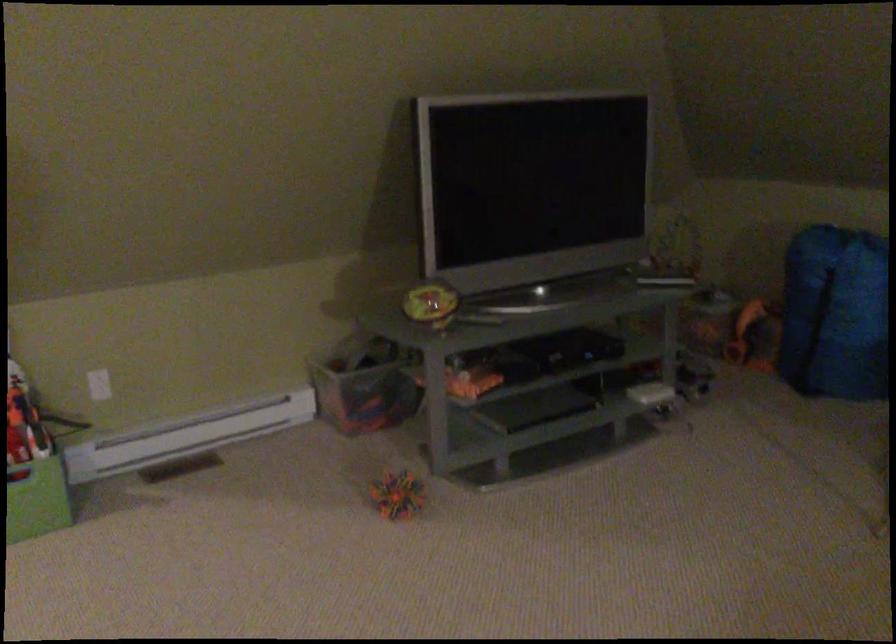
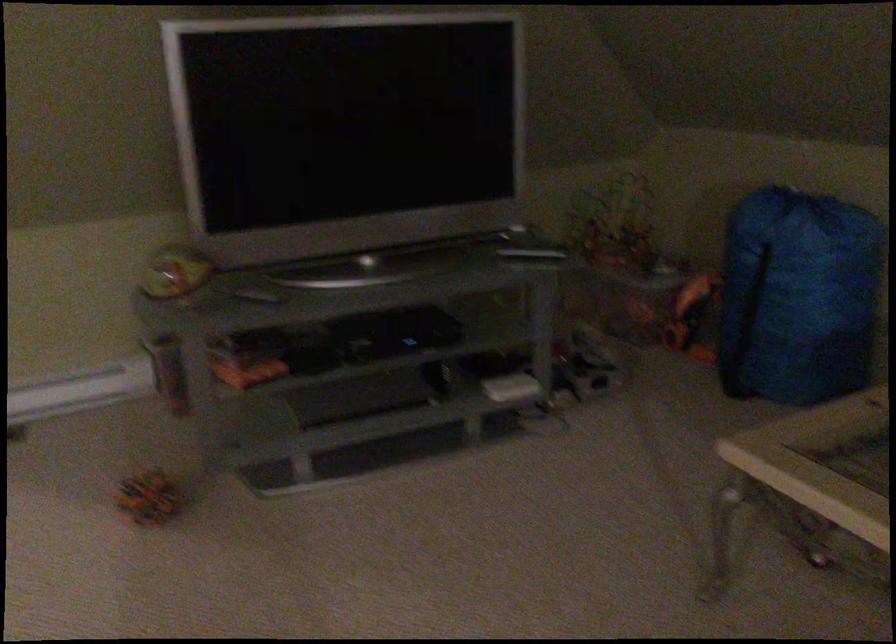
Question: The camera is either moving clockwise (left) or counter-clockwise (right) around the object. The first image is from the beginning of the video and the second image is from the end. Is the camera moving left or right when shooting the video?

Choices:
 (A) Left
 (B) Right

Answer: (B)